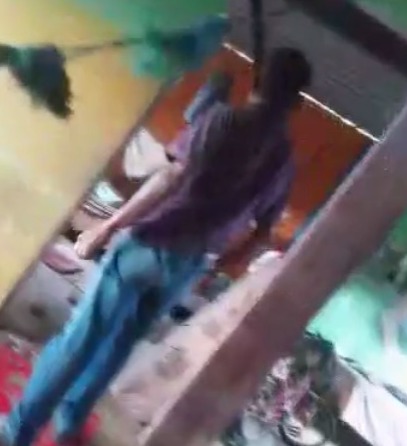
This screenshot has width=407, height=446. I want to click on grey weight bearing column, so click(x=334, y=253).